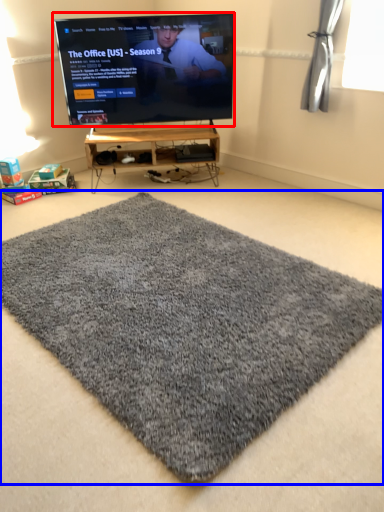
Question: Which point is closer to the camera, television (highlighted by a red box) or mat (highlighted by a blue box)?

Choices:
 (A) television
 (B) mat

Answer: (B)